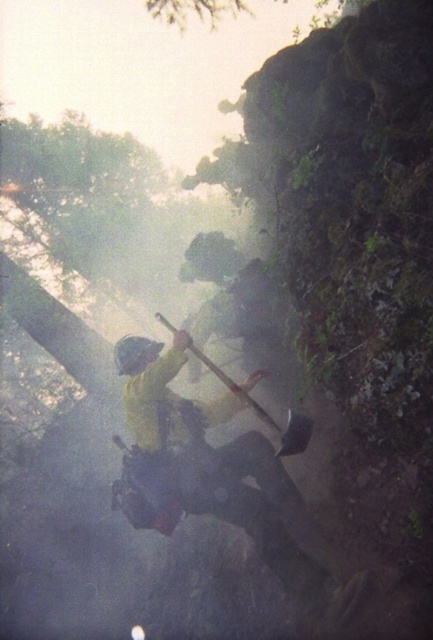
Can you confirm if yellow matte jacket at center is positioned above matte yellow helmet at center?

No.

Which of these two, yellow matte jacket at center or matte yellow helmet at center, stands shorter?

matte yellow helmet at center is shorter.

Consider the image. Who is more forward, (168,353) or (126,369)?

Point (168,353)

You are a GUI agent. You are given a task and a screenshot of the screen. Output one action in this format:
    pyautogui.click(x=<x>, y=<y>)
    Task: Click on the yellow matte jacket at center
    Image resolution: width=433 pixels, height=640 pixels.
    Given the screenshot: What is the action you would take?
    pyautogui.click(x=222, y=483)